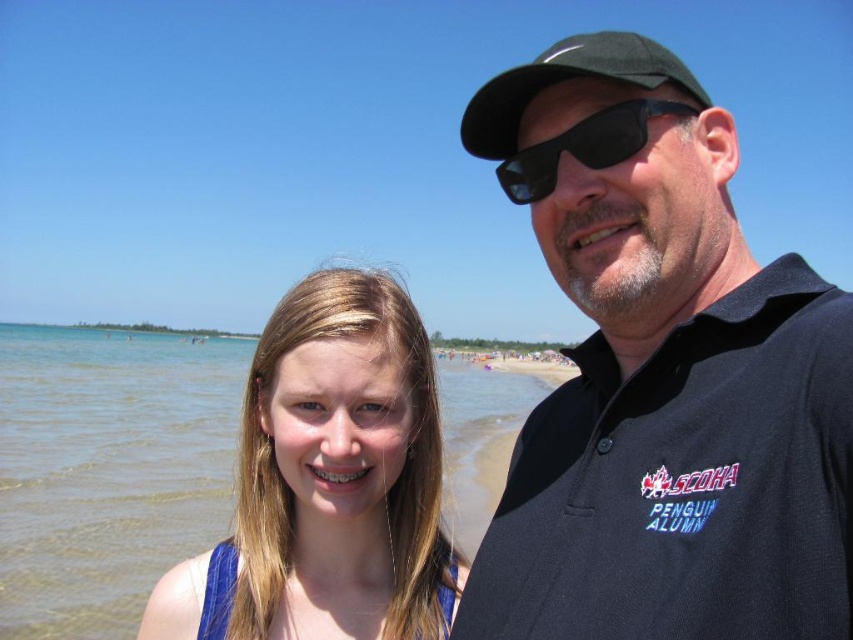
Question: Which point is farther to the camera?

Choices:
 (A) (343, 548)
 (B) (637, 554)

Answer: (A)

Question: Can you confirm if black matte cap at upper right is thinner than black matte sunglasses at upper center?

Choices:
 (A) yes
 (B) no

Answer: (B)

Question: Does black matte cap at upper right appear under green fabric baseball cap at upper right?

Choices:
 (A) no
 (B) yes

Answer: (B)

Question: Which of the following is the closest to the observer?

Choices:
 (A) black matte sunglasses at upper center
 (B) green fabric baseball cap at upper right
 (C) blonde hair at center
 (D) black matte cap at upper right

Answer: (D)

Question: Which point is closer to the camera?

Choices:
 (A) blonde hair at center
 (B) black matte cap at upper right
 (C) black matte sunglasses at upper center

Answer: (B)

Question: Can you confirm if black matte cap at upper right is bigger than black matte sunglasses at upper center?

Choices:
 (A) no
 (B) yes

Answer: (B)